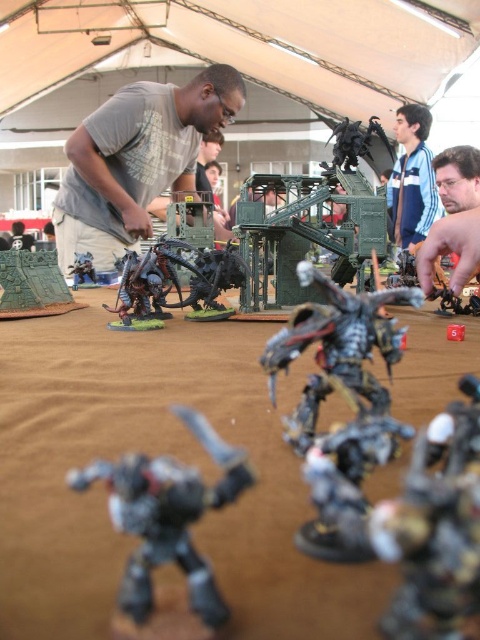
Question: Which of these objects is positioned closest to the green plastic terrain at left?

Choices:
 (A) metallic silver figure at center
 (B) matte gray helmet at upper right
 (C) shiny metallic robot at center

Answer: (B)

Question: Is gray matte shirt at center positioned in front of green plastic terrain at left?

Choices:
 (A) yes
 (B) no

Answer: (B)

Question: Which is farther from the gray matte shirt at center?

Choices:
 (A) blue striped shirt at upper center
 (B) shiny metallic robot at center

Answer: (B)

Question: Can you confirm if gray matte shirt at center is positioned below matte gray helmet at upper right?

Choices:
 (A) no
 (B) yes

Answer: (A)

Question: Does blue striped shirt at upper center appear on the left side of green plastic terrain at left?

Choices:
 (A) yes
 (B) no

Answer: (B)

Question: Among these points, which one is farthest from the camera?

Choices:
 (A) (64, 262)
 (B) (81, 273)

Answer: (A)